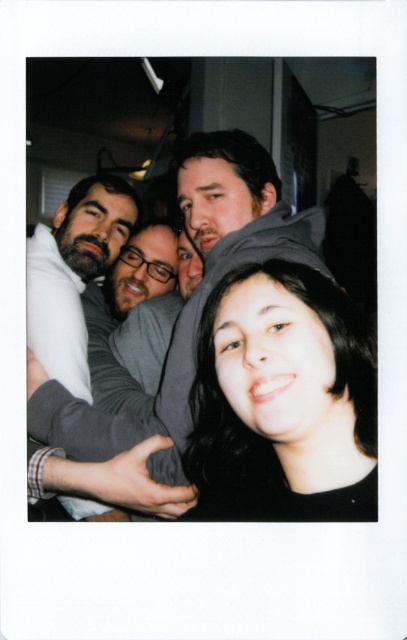
Question: Estimate the real-world distances between objects in this image. Which object is farther from the dark gray sweater at left?

Choices:
 (A) black matte hair at center
 (B) gray hoodie at center

Answer: (A)

Question: Which object is closer to the camera taking this photo?

Choices:
 (A) black matte hair at center
 (B) dark gray sweater at left
 (C) gray hoodie at center

Answer: (A)

Question: Is gray hoodie at center to the right of dark gray sweater at left from the viewer's perspective?

Choices:
 (A) no
 (B) yes

Answer: (B)

Question: Is black matte hair at center to the right of dark gray sweater at left from the viewer's perspective?

Choices:
 (A) yes
 (B) no

Answer: (A)

Question: Considering the relative positions of black matte hair at center and gray hoodie at center in the image provided, where is black matte hair at center located with respect to gray hoodie at center?

Choices:
 (A) right
 (B) left

Answer: (A)

Question: Which is nearer to the black matte hair at center?

Choices:
 (A) dark gray sweater at left
 (B) gray hoodie at center

Answer: (B)